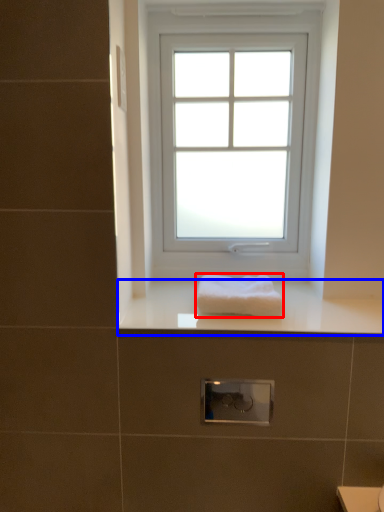
Question: Which object appears farthest to the camera in this image, towel (highlighted by a red box) or counter top (highlighted by a blue box)?

Choices:
 (A) towel
 (B) counter top

Answer: (A)